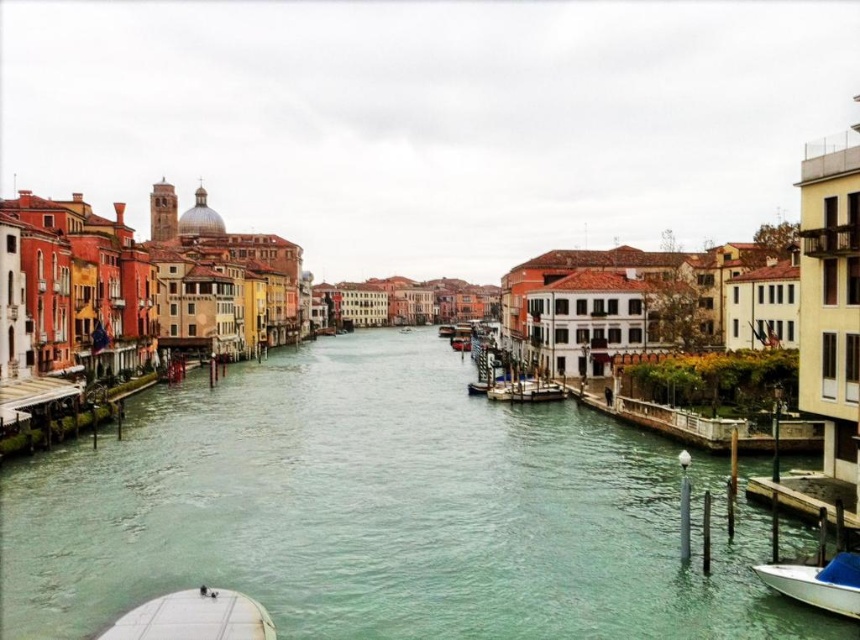
Question: Can you confirm if greenish water at center is bigger than wooden dock at center?

Choices:
 (A) no
 (B) yes

Answer: (B)

Question: Does wooden dock at center appear on the right side of wooden boat at center?

Choices:
 (A) no
 (B) yes

Answer: (B)

Question: Can you confirm if wooden dock at center is positioned below wooden boat at center?

Choices:
 (A) no
 (B) yes

Answer: (B)

Question: Among these points, which one is farthest from the camera?

Choices:
 (A) (836, 557)
 (B) (453, 330)
 (C) (557, 397)

Answer: (B)

Question: Which is farther from the greenish water at center?

Choices:
 (A) wooden dock at center
 (B) white matte boat at lower right

Answer: (B)

Question: Based on their relative distances, which object is farther from the wooden dock at center?

Choices:
 (A) wooden boat at center
 (B) greenish water at center
 (C) white matte boat at lower right

Answer: (A)